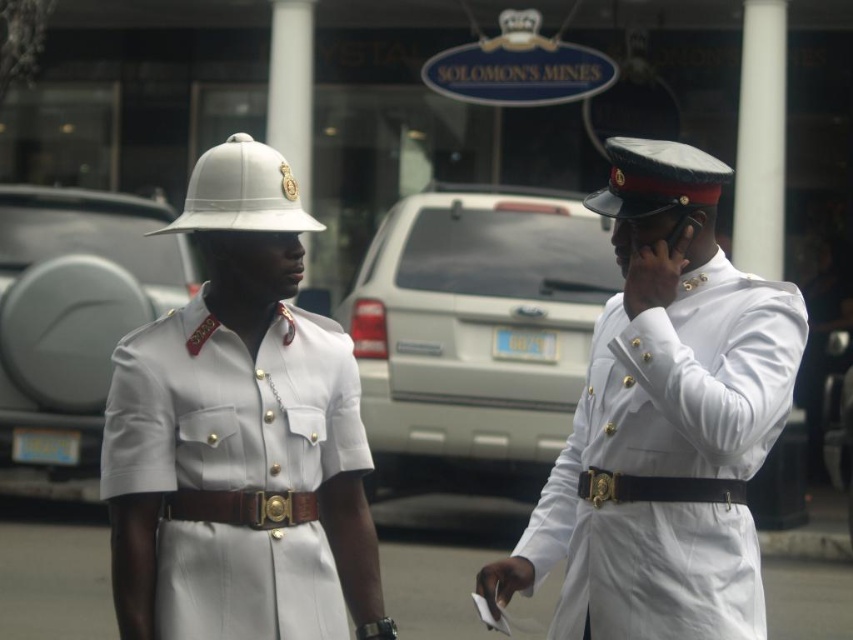
Which is more to the left, white glossy uniform at center or black leather belt at center?

white glossy uniform at center is more to the left.

Is point (166, 570) positioned before point (593, 502)?

Yes.

Where is `white glossy uniform at center`? Image resolution: width=853 pixels, height=640 pixels. white glossy uniform at center is located at coordinates (236, 467).

Is white glossy uniform at center smaller than brown leather belt at center?

Actually, white glossy uniform at center might be larger than brown leather belt at center.

You are a GUI agent. You are given a task and a screenshot of the screen. Output one action in this format:
    pyautogui.click(x=<x>, y=<y>)
    Task: Click on the white glossy uniform at center
    The image size is (853, 640).
    Given the screenshot: What is the action you would take?
    pyautogui.click(x=236, y=467)

Image resolution: width=853 pixels, height=640 pixels. I want to click on white glossy uniform at center, so click(x=236, y=467).

Is white glossy uniform at right smaller than white glossy uniform at center?

No, white glossy uniform at right is not smaller than white glossy uniform at center.

Can you confirm if white glossy uniform at right is wider than white glossy uniform at center?

Correct, the width of white glossy uniform at right exceeds that of white glossy uniform at center.

Who is more distant from viewer, (705, 636) or (247, 545)?

Result: Positioned behind is point (705, 636).

Image resolution: width=853 pixels, height=640 pixels. Identify the location of white glossy uniform at right. (670, 461).